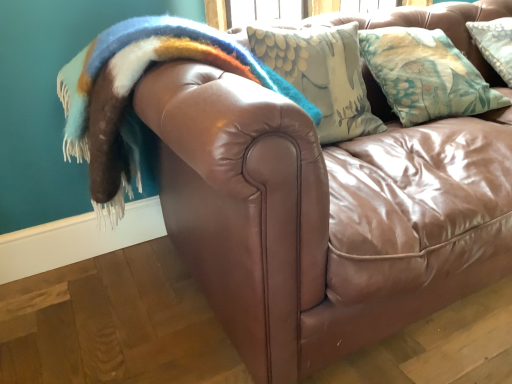
Question: Considering the relative sizes of floral fabric pillow at upper right and fuzzy woolen blanket at upper left in the image provided, is floral fabric pillow at upper right smaller than fuzzy woolen blanket at upper left?

Choices:
 (A) yes
 (B) no

Answer: (A)

Question: From the image's perspective, does floral fabric pillow at upper right appear higher than fuzzy woolen blanket at upper left?

Choices:
 (A) no
 (B) yes

Answer: (B)

Question: From a real-world perspective, is floral fabric pillow at upper right physically below fuzzy woolen blanket at upper left?

Choices:
 (A) yes
 (B) no

Answer: (A)

Question: Considering the relative sizes of floral fabric pillow at upper right and fuzzy woolen blanket at upper left in the image provided, is floral fabric pillow at upper right shorter than fuzzy woolen blanket at upper left?

Choices:
 (A) yes
 (B) no

Answer: (A)

Question: Is floral fabric pillow at upper right turned away from fuzzy woolen blanket at upper left?

Choices:
 (A) no
 (B) yes

Answer: (A)

Question: From a real-world perspective, is floral fabric pillow at upper right located higher than fuzzy woolen blanket at upper left?

Choices:
 (A) yes
 (B) no

Answer: (B)

Question: From a real-world perspective, is fuzzy woolen blanket at upper left located beneath floral fabric pillow at upper right?

Choices:
 (A) yes
 (B) no

Answer: (B)

Question: Is the position of fuzzy woolen blanket at upper left more distant than that of floral fabric pillow at upper right?

Choices:
 (A) yes
 (B) no

Answer: (B)

Question: Does fuzzy woolen blanket at upper left have a greater width compared to floral fabric pillow at upper right?

Choices:
 (A) yes
 (B) no

Answer: (A)

Question: Can you confirm if fuzzy woolen blanket at upper left is shorter than floral fabric pillow at upper right?

Choices:
 (A) no
 (B) yes

Answer: (A)

Question: Is fuzzy woolen blanket at upper left oriented away from floral fabric pillow at upper right?

Choices:
 (A) no
 (B) yes

Answer: (A)

Question: Can you confirm if fuzzy woolen blanket at upper left is smaller than floral fabric pillow at upper right?

Choices:
 (A) no
 (B) yes

Answer: (A)

Question: Visually, is fuzzy woolen blanket at upper left positioned to the left or to the right of floral fabric pillow at upper right?

Choices:
 (A) left
 (B) right

Answer: (A)